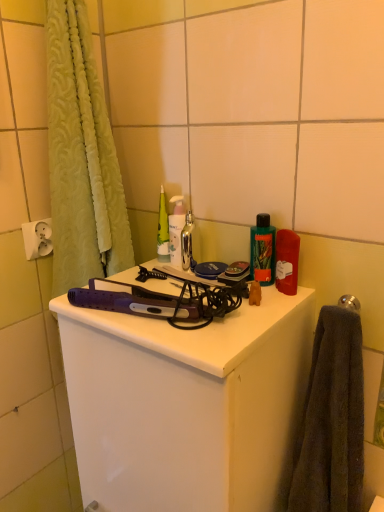
Where is `shiny metallic faucet at center`? The image size is (384, 512). shiny metallic faucet at center is located at coordinates (187, 243).

You are a GUI agent. You are given a task and a screenshot of the screen. Output one action in this format:
    pyautogui.click(x=<x>, y=<y>)
    Task: Click on the polished silver towel bar at upper right
    The image size is (384, 512).
    Given the screenshot: What is the action you would take?
    pyautogui.click(x=349, y=303)

Measure the distance between point (51, 243) and camera.

Point (51, 243) and camera are 96.60 centimeters apart.

In order to face metallic silver bottle at center, which is the second toiletry from right to left, should I rotate leftwards or rightwards?

Turn left by 1.910 degrees to look at metallic silver bottle at center, which is the second toiletry from right to left.

This screenshot has width=384, height=512. I want to click on green plastic bottle at upper right, the 1th toiletry in the front-to-back sequence, so click(262, 250).

Between point (179, 218) and point (344, 300), which one is positioned in front?

Positioned in front is point (344, 300).

From the picture: Could you tell me if metallic silver bottle at center, the 1th toiletry in the left-to-right sequence, is turned towards polished silver towel bar at upper right?

No, metallic silver bottle at center, the 1th toiletry in the left-to-right sequence, is not facing towards polished silver towel bar at upper right.

In the scene shown: Is metallic silver bottle at center, the 1th toiletry in the left-to-right sequence, located outside polished silver towel bar at upper right?

Yes.

Can you confirm if metallic silver bottle at center, which is the second toiletry from right to left, is bigger than polished silver towel bar at upper right?

Indeed, metallic silver bottle at center, which is the second toiletry from right to left, has a larger size compared to polished silver towel bar at upper right.

Identify the location of bathroom cabinet below the dark gray towel at right (from a real-world perspective). Image resolution: width=384 pixels, height=512 pixels. (188, 404).

Is purple plastic hair straightener at center directly adjacent to dark gray towel at right?

No.

Considering the positions of objects purple plastic hair straightener at center and dark gray towel at right in the image provided, who is behind, purple plastic hair straightener at center or dark gray towel at right?

Positioned behind is dark gray towel at right.

Based on the photo, considering the positions of objects purple plastic hair straightener at center and dark gray towel at right in the image provided, who is more to the right, purple plastic hair straightener at center or dark gray towel at right?

dark gray towel at right is more to the right.

Considering the points (268, 224) and (335, 436), which point is in front, point (268, 224) or point (335, 436)?

Positioned in front is point (335, 436).

In the scene shown: Can you tell me how much green plastic bottle at upper right, acting as the second toiletry starting from the back, and dark gray towel at right differ in facing direction?

The angle between the facing direction of green plastic bottle at upper right, acting as the second toiletry starting from the back, and the facing direction of dark gray towel at right is 5.12e-05 degrees.

Which object is positioned more to the right, green plastic bottle at upper right, acting as the second toiletry starting from the back, or dark gray towel at right?

Positioned to the right is dark gray towel at right.

Does green plastic bottle at upper right, acting as the second toiletry starting from the back, turn towards dark gray towel at right?

No, green plastic bottle at upper right, acting as the second toiletry starting from the back, is not turned towards dark gray towel at right.

Which is more to the right, white plastic electric outlet at upper left or dark gray towel at right?

Positioned to the right is dark gray towel at right.

From the image's perspective, between white plastic electric outlet at upper left and dark gray towel at right, which one is located above?

white plastic electric outlet at upper left.

Does white plastic electric outlet at upper left have a greater height compared to dark gray towel at right?

In fact, white plastic electric outlet at upper left may be shorter than dark gray towel at right.

From a real-world perspective, who is located lower, purple plastic hair straightener at center or green plastic bottle at upper right, the 1th toiletry in the front-to-back sequence?

From a 3D spatial view, purple plastic hair straightener at center is below.

How far apart are purple plastic hair straightener at center and green plastic bottle at upper right, acting as the second toiletry starting from the back?

12.12 inches.

Which is in front, point (201, 505) or point (273, 238)?

Positioned in front is point (201, 505).

Which object is closer to the camera taking this photo, shiny metallic faucet at center or green plastic bottle at upper right, acting as the second toiletry starting from the back?

green plastic bottle at upper right, acting as the second toiletry starting from the back, is in front.

Does point (192, 219) appear closer or farther from the camera than point (259, 243)?

Point (192, 219) appears to be farther away from the viewer than point (259, 243).

From a real-world perspective, who is located lower, shiny metallic faucet at center or green plastic bottle at upper right, the 1th toiletry in the front-to-back sequence?

In real-world perspective, shiny metallic faucet at center is lower.

Is shiny metallic faucet at center taller or shorter than green plastic bottle at upper right, acting as the second toiletry starting from the back?

In the image, shiny metallic faucet at center appears to be shorter than green plastic bottle at upper right, acting as the second toiletry starting from the back.

Is metallic silver bottle at center, arranged as the first toiletry when viewed from the back, inside or outside of green plastic bottle at upper right, which appears as the first toiletry when viewed from the right?

metallic silver bottle at center, arranged as the first toiletry when viewed from the back, exists outside the volume of green plastic bottle at upper right, which appears as the first toiletry when viewed from the right.

In terms of height, does metallic silver bottle at center, which is the second toiletry from right to left, look taller or shorter compared to green plastic bottle at upper right, acting as the second toiletry starting from the back?

Clearly, metallic silver bottle at center, which is the second toiletry from right to left, is taller compared to green plastic bottle at upper right, acting as the second toiletry starting from the back.

I want to click on toiletry that appears below the metallic silver bottle at center, the 1th toiletry in the left-to-right sequence (from a real-world perspective), so click(262, 250).

Which point is more forward, (x=172, y=226) or (x=271, y=266)?

The point (x=271, y=266) is more forward.

From a real-world perspective, which toiletry is the 2nd one above the polished silver towel bar at upper right? Please provide its 2D coordinates.

[(176, 230)]

The height and width of the screenshot is (512, 384). In order to click on bathroom cabinet beneath the dark gray towel at right (from a real-world perspective) in this screenshot , I will do `click(188, 404)`.

Considering their positions, is metallic silver bottle at center, the 1th toiletry in the left-to-right sequence, positioned further to green plastic bottle at upper right, the 1th toiletry in the front-to-back sequence, than polished silver towel bar at upper right?

metallic silver bottle at center, the 1th toiletry in the left-to-right sequence, is further to green plastic bottle at upper right, the 1th toiletry in the front-to-back sequence.

Which object lies further to the anchor point metallic silver bottle at center, the 1th toiletry in the left-to-right sequence, white plastic electric outlet at upper left or green plastic bottle at upper right, acting as the second toiletry starting from the back?

white plastic electric outlet at upper left is further to metallic silver bottle at center, the 1th toiletry in the left-to-right sequence.

Considering their positions, is polished silver towel bar at upper right positioned further to metallic silver bottle at center, the 2th toiletry from the front, than shiny metallic faucet at center?

The object further to metallic silver bottle at center, the 2th toiletry from the front, is polished silver towel bar at upper right.

From the image, which object appears to be nearer to shiny metallic faucet at center, metallic silver bottle at center, which is the second toiletry from right to left, or polished silver towel bar at upper right?

Based on the image, metallic silver bottle at center, which is the second toiletry from right to left, appears to be nearer to shiny metallic faucet at center.

Considering their positions, is green plastic bottle at upper right, acting as the second toiletry starting from the back, positioned further to white plastic electric outlet at upper left than polished silver towel bar at upper right?

polished silver towel bar at upper right is further to white plastic electric outlet at upper left.

Based on their spatial positions, is green plastic bottle at upper right, the 1th toiletry in the front-to-back sequence, or shiny metallic faucet at center closer to dark gray towel at right?

green plastic bottle at upper right, the 1th toiletry in the front-to-back sequence, is positioned closer to the anchor dark gray towel at right.

Which object lies nearer to the anchor point metallic silver bottle at center, the 1th toiletry in the left-to-right sequence, polished silver towel bar at upper right or green plastic bottle at upper right, acting as the second toiletry starting from the back?

green plastic bottle at upper right, acting as the second toiletry starting from the back, lies closer to metallic silver bottle at center, the 1th toiletry in the left-to-right sequence, than the other object.

Looking at the image, which one is located closer to shiny metallic faucet at center, polished silver towel bar at upper right or green plastic bottle at upper right, acting as the second toiletry starting from the back?

Among the two, green plastic bottle at upper right, acting as the second toiletry starting from the back, is located nearer to shiny metallic faucet at center.

You are a GUI agent. You are given a task and a screenshot of the screen. Output one action in this format:
    pyautogui.click(x=<x>, y=<y>)
    Task: Click on the toiletry located between metallic silver bottle at center, which is the second toiletry from right to left, and polished silver towel bar at upper right in the left-right direction
    
    Given the screenshot: What is the action you would take?
    pyautogui.click(x=262, y=250)

Where is `bathroom cabinet located between white plastic electric outlet at upper left and polished silver towel bar at upper right in the left-right direction`? The height and width of the screenshot is (512, 384). bathroom cabinet located between white plastic electric outlet at upper left and polished silver towel bar at upper right in the left-right direction is located at coordinates (188, 404).

Find the location of a particular element. Image resolution: width=384 pixels, height=512 pixels. toiletry between white plastic electric outlet at upper left and green plastic bottle at upper right, placed as the second toiletry when sorted from left to right, in the horizontal direction is located at coordinates (176, 230).

Find the location of a particular element. Image resolution: width=384 pixels, height=512 pixels. toiletry between shiny metallic faucet at center and polished silver towel bar at upper right in the horizontal direction is located at coordinates (262, 250).